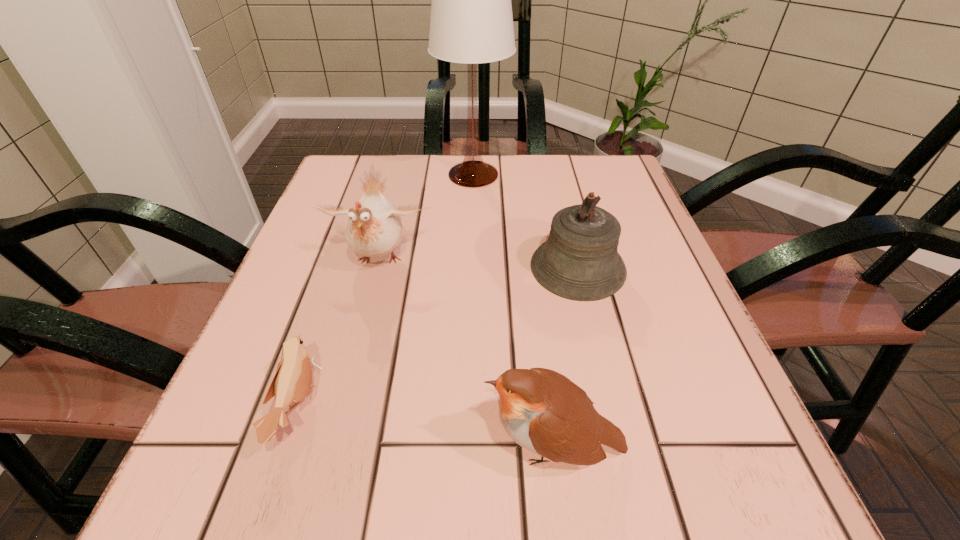
The image size is (960, 540). What are the coordinates of `table lamp` in the screenshot? It's located at (471, 22).

The height and width of the screenshot is (540, 960). What are the coordinates of `the tallest object` in the screenshot? It's located at (471, 22).

The image size is (960, 540). What are the coordinates of `the farthest bird` in the screenshot? It's located at (374, 229).

At what (x,y) coordinates should I click in order to perform the action: click on bell. Please return your answer as a coordinate pair (x, y). Image resolution: width=960 pixels, height=540 pixels. Looking at the image, I should click on (580, 261).

Where is `the rightmost bird`? The image size is (960, 540). the rightmost bird is located at coordinates (543, 411).

This screenshot has height=540, width=960. What are the coordinates of `the shortest bird` in the screenshot? It's located at (292, 381).

Where is `free space located 0.180m above the cylindrical shade of the farthest object`? The height and width of the screenshot is (540, 960). free space located 0.180m above the cylindrical shade of the farthest object is located at coordinates (583, 175).

At what (x,y) coordinates should I click in order to perform the action: click on blank space located at the beak of the farthest bird. Please return your answer as a coordinate pair (x, y). Looking at the image, I should click on [x=341, y=414].

Find the location of `vacant space located on the left of the bell`. vacant space located on the left of the bell is located at coordinates (446, 268).

Locate an element on the screen. The width and height of the screenshot is (960, 540). free space located 0.150m at the face of the rightmost bird is located at coordinates (369, 447).